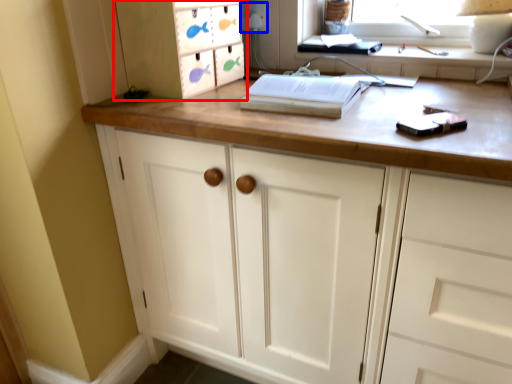
Question: Which object is further to the camera taking this photo, cabinetry (highlighted by a red box) or electric outlet (highlighted by a blue box)?

Choices:
 (A) cabinetry
 (B) electric outlet

Answer: (B)